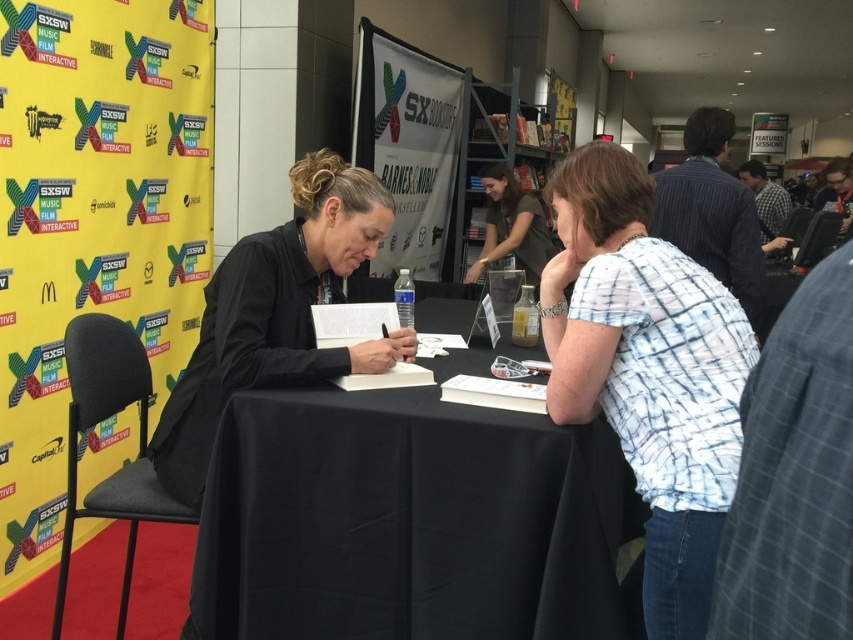
Does black fabric table at center appear on the right side of dark corduroy blazer at upper right?

No, black fabric table at center is not to the right of dark corduroy blazer at upper right.

How much distance is there between black fabric table at center and dark corduroy blazer at upper right?

black fabric table at center is 1.31 meters away from dark corduroy blazer at upper right.

This screenshot has height=640, width=853. What are the coordinates of `black fabric table at center` in the screenshot? It's located at (410, 522).

The height and width of the screenshot is (640, 853). What do you see at coordinates (647, 371) in the screenshot?
I see `white tie-dye shirt at center` at bounding box center [647, 371].

What do you see at coordinates (647, 371) in the screenshot? The image size is (853, 640). I see `white tie-dye shirt at center` at bounding box center [647, 371].

Find the location of a particular element. This screenshot has height=640, width=853. white tie-dye shirt at center is located at coordinates (647, 371).

Is black matte shirt at center wider than dark corduroy blazer at upper right?

Yes, black matte shirt at center is wider than dark corduroy blazer at upper right.

How far apart are black matte shirt at center and dark corduroy blazer at upper right?

black matte shirt at center is 5.01 feet from dark corduroy blazer at upper right.

Is point (276, 360) farther from viewer compared to point (703, 184)?

No, it is not.

Locate an element on the screen. black matte shirt at center is located at coordinates point(276,314).